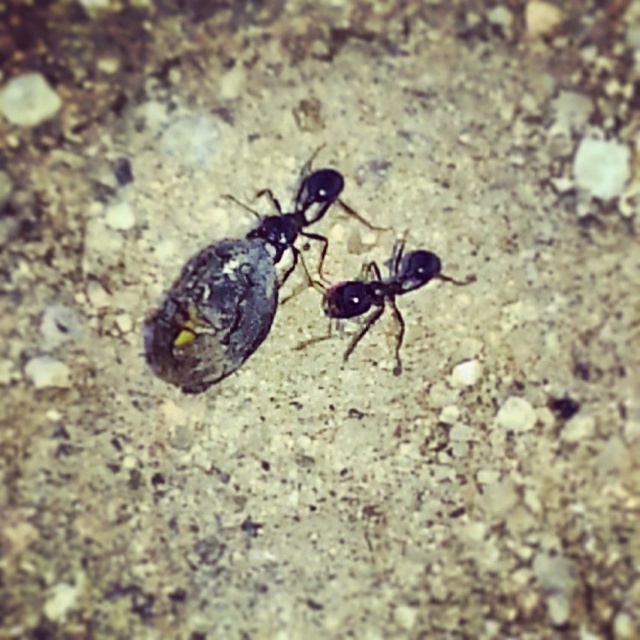
You are a photographer standing at point A. You want to take a photo of the scene so that the point at coordinates point (180,273) is clearly visible. If your camera has a focal length of 50mm and you need the subject to be in focus at a distance of exactly 1 meter, should you move closer or farther away from the point?

The point at coordinates point (180,273) is 1.13 meters away from the camera. Since the camera needs the subject to be in focus at exactly 1 meter, you should move closer to reduce the distance to 1 meter.

You are an entomologist studying ants in a dimly lit environment. You observe two ants, the black matte ant at center and the black glossy ant at center. Which ant appears taller when viewed from above?

The black matte ant at center appears taller than the black glossy ant at center when viewed from above.

You are a photographer taking a closeup shot of two ants near a sphere on a sandy surface. You want to focus on the point closer to the camera. Which point should you focus on, point (x=326, y=177) or point (x=392, y=260)?

Point (x=326, y=177) is closer to the camera than point (x=392, y=260), so you should focus on point (x=326, y=177) to capture the ants near the sphere clearly.